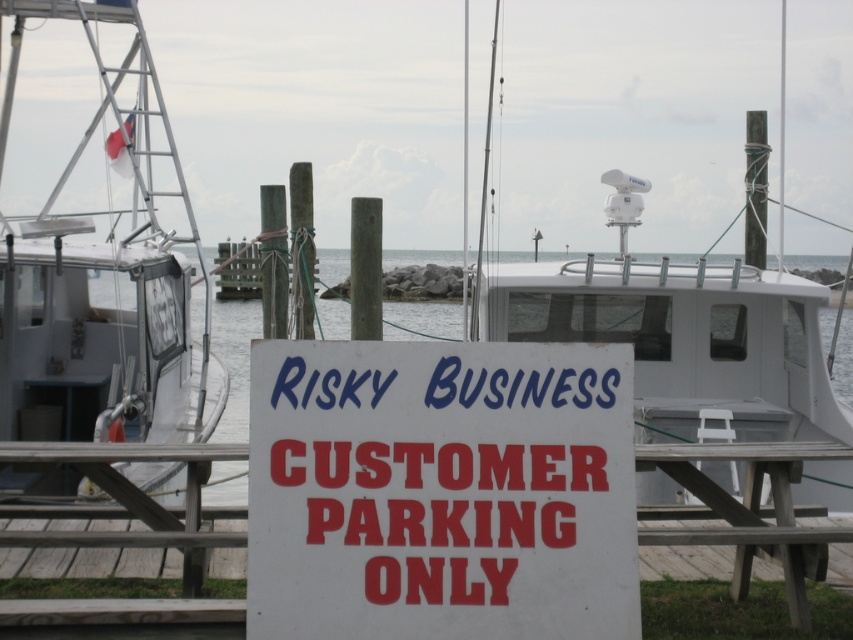
Question: Estimate the real-world distances between objects in this image. Which object is closer to the transparent water at center?

Choices:
 (A) white wooden dock at center
 (B) white glossy boat at left

Answer: (B)

Question: Does white paper sign at center appear on the left side of transparent water at center?

Choices:
 (A) yes
 (B) no

Answer: (A)

Question: Which point is closer to the camera taking this photo?

Choices:
 (A) (747, 461)
 (B) (802, 548)
 (C) (22, 481)
 (D) (815, 500)

Answer: (B)

Question: Is white glossy boat at left positioned behind white wooden dock at center?

Choices:
 (A) no
 (B) yes

Answer: (B)

Question: Is white glossy boat at left smaller than transparent water at center?

Choices:
 (A) yes
 (B) no

Answer: (A)

Question: Which point is closer to the camera?

Choices:
 (A) white paper sign at center
 (B) white wooden dock at center
 (C) wooden picnic table at center
 (D) white glossy boat at left

Answer: (A)